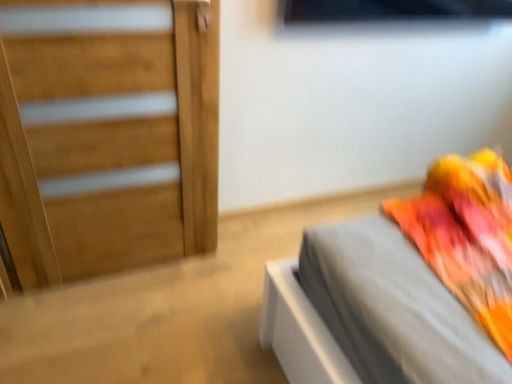
Where is `vacant region under wooden door at left (from a real-world perspective)`? The image size is (512, 384). vacant region under wooden door at left (from a real-world perspective) is located at coordinates (122, 276).